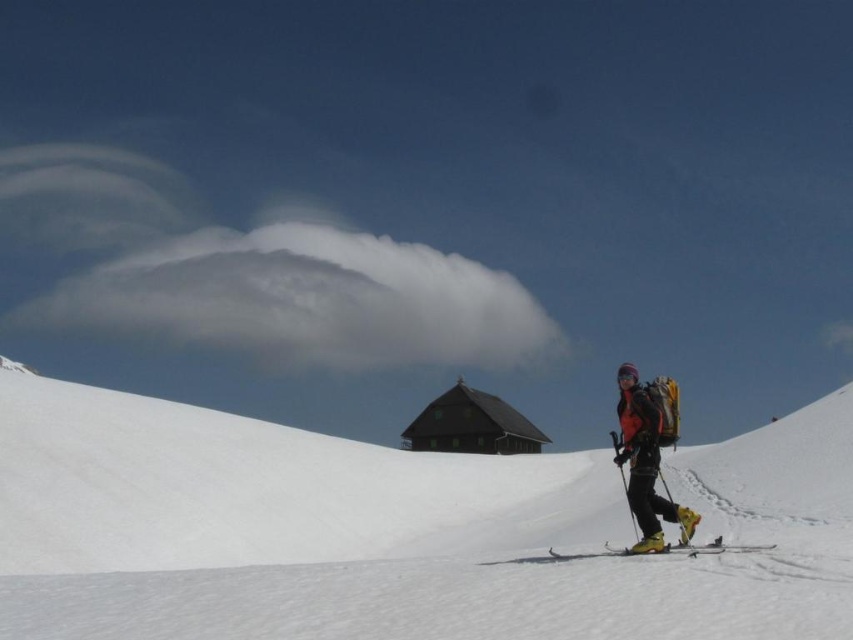
Is point (817, 465) closer to viewer compared to point (480, 275)?

Yes, point (817, 465) is closer to viewer.

Measure the distance between point (74, 509) and camera.

They are 31.16 meters apart.

This screenshot has width=853, height=640. I want to click on white powder snow at center, so [395, 531].

Does point (113, 266) come farther from viewer compared to point (430, 413)?

That is True.

Is white fluffy cloud at upper center shorter than dark brown wooden hut at center?

In fact, white fluffy cloud at upper center may be taller than dark brown wooden hut at center.

Is point (323, 243) less distant than point (503, 410)?

No, it is behind (503, 410).

Identify the location of white fluffy cloud at upper center. (308, 300).

Which is behind, point (677, 520) or point (440, 400)?

Point (440, 400)

Does orange fabric jacket at right appear on the left side of dark brown wooden hut at center?

In fact, orange fabric jacket at right is to the right of dark brown wooden hut at center.

Identify the location of orange fabric jacket at right. (648, 452).

This screenshot has width=853, height=640. Identify the location of orange fabric jacket at right. (648, 452).